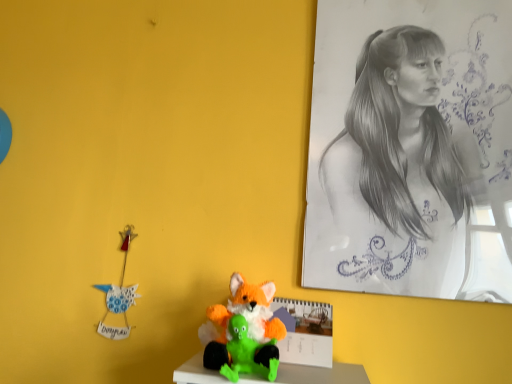
Question: Is fluffy orange and green plush toy at center, which ranks as the first toy in back-to-front order, bigger or smaller than graphite sketch at upper right?

Choices:
 (A) big
 (B) small

Answer: (B)

Question: From the image's perspective, is fluffy orange and green plush toy at center, which ranks as the first toy in back-to-front order, located above or below graphite sketch at upper right?

Choices:
 (A) below
 (B) above

Answer: (A)

Question: Which is nearer to the fluffy orange fox at center, placed as the second toy when sorted from back to front?

Choices:
 (A) graphite sketch at upper right
 (B) fluffy orange and green plush toy at center, which ranks as the first toy in back-to-front order

Answer: (B)

Question: Which object is the farthest from the fluffy orange and green plush toy at center, which ranks as the first toy in back-to-front order?

Choices:
 (A) graphite sketch at upper right
 (B) fluffy orange fox at center, which is counted as the first toy, starting from the front

Answer: (A)